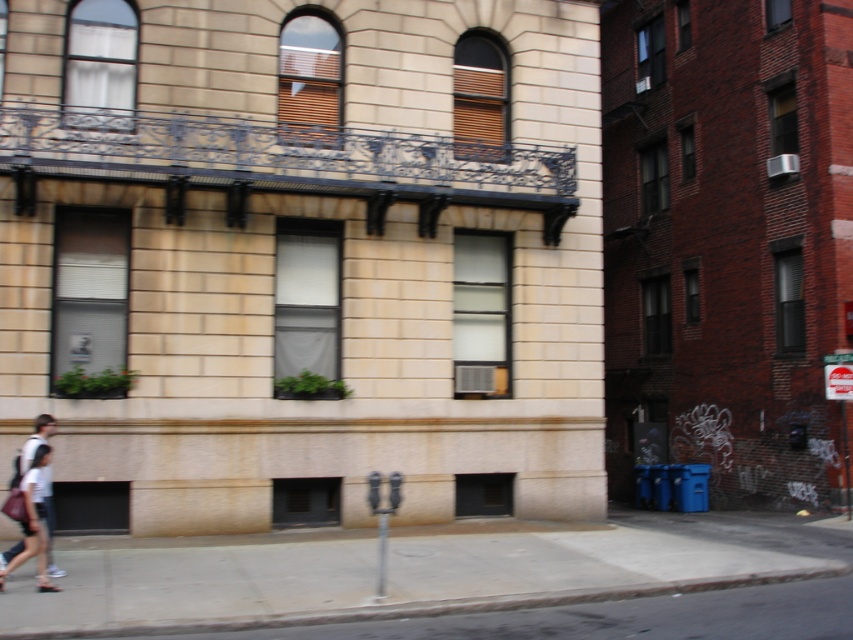
You are a delivery person trying to walk from the gray concrete sidewalk at lower center to the white cotton shirt at lower left. Can you walk straight ahead without stepping off the sidewalk?

The gray concrete sidewalk at lower center is wider than the white cotton shirt at lower left, so you can walk straight ahead without stepping off the sidewalk.